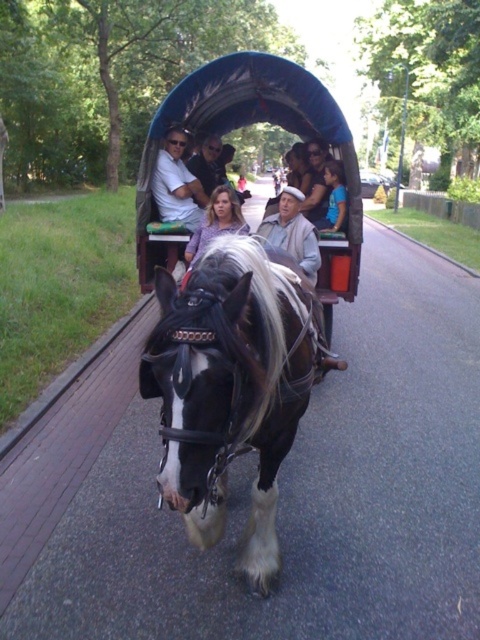
Question: Is white cotton shirt at upper center below blue denim jacket at center?

Choices:
 (A) no
 (B) yes

Answer: (A)

Question: Does matte white shirt at center appear over white cotton shirt at upper center?

Choices:
 (A) no
 (B) yes

Answer: (B)

Question: Is shiny blue fabric cart at center to the right of smooth purple blouse at center from the viewer's perspective?

Choices:
 (A) no
 (B) yes

Answer: (A)

Question: Which point is farther to the camera?

Choices:
 (A) black glossy horse at center
 (B) white cotton shirt at upper center

Answer: (B)

Question: Among these objects, which one is farthest from the camera?

Choices:
 (A) blue denim jacket at center
 (B) white cotton shirt at upper center
 (C) black glossy horse at center

Answer: (A)

Question: Which point is closer to the camera taking this photo?

Choices:
 (A) (331, 304)
 (B) (180, 134)

Answer: (A)